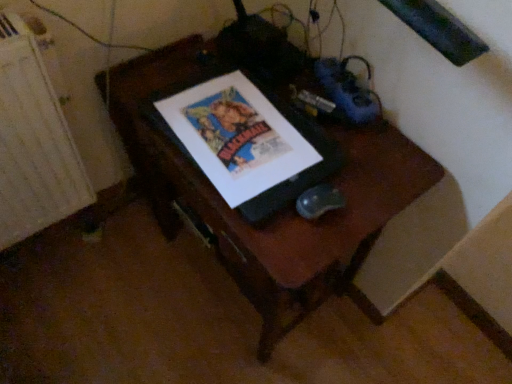
The height and width of the screenshot is (384, 512). Find the location of `vacant space situated above wooden desk at center (from a real-world perspective)`. vacant space situated above wooden desk at center (from a real-world perspective) is located at coordinates (325, 137).